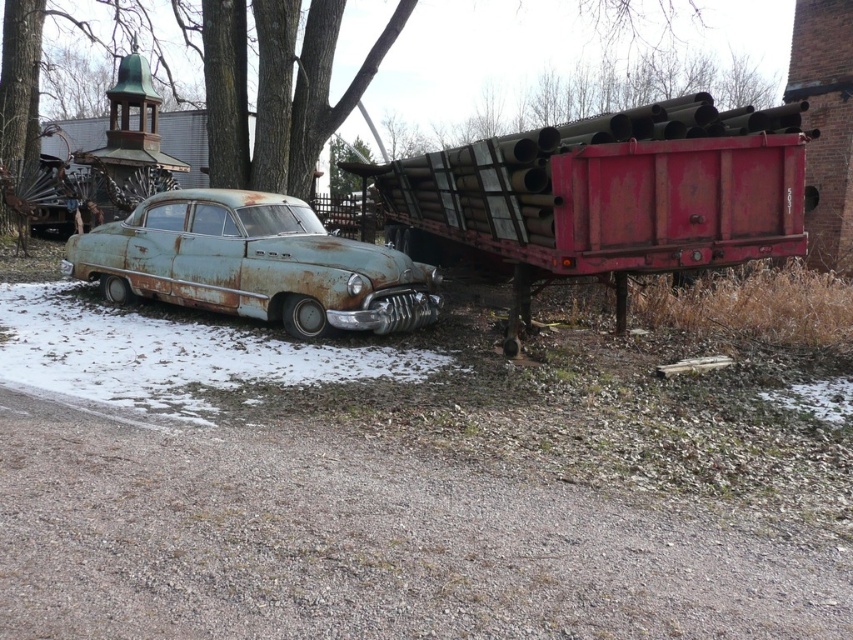
Question: Is rusty metal trailer truck at right to the right of rusty metal car at center from the viewer's perspective?

Choices:
 (A) yes
 (B) no

Answer: (A)

Question: Which point is closer to the camera taking this photo?

Choices:
 (A) (163, 228)
 (B) (494, 252)

Answer: (B)

Question: Is rusty metal trailer truck at right thinner than rusty metal car at center?

Choices:
 (A) yes
 (B) no

Answer: (B)

Question: Is rusty metal trailer truck at right wider than rusty metal car at center?

Choices:
 (A) yes
 (B) no

Answer: (A)